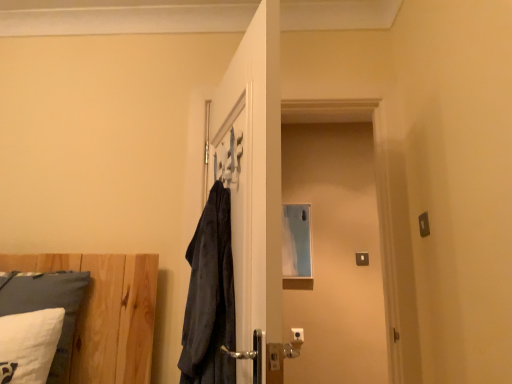
Question: Is transparent glass screen door at center taller or shorter than white soft pillow at lower left?

Choices:
 (A) short
 (B) tall

Answer: (B)

Question: Which is correct: transparent glass screen door at center is inside white soft pillow at lower left, or outside of it?

Choices:
 (A) inside
 (B) outside

Answer: (B)

Question: From the image's perspective, is transparent glass screen door at center above or below white soft pillow at lower left?

Choices:
 (A) above
 (B) below

Answer: (A)

Question: In terms of width, does white soft pillow at lower left look wider or thinner when compared to transparent glass screen door at center?

Choices:
 (A) thin
 (B) wide

Answer: (B)

Question: In the image, is white soft pillow at lower left positioned in front of or behind transparent glass screen door at center?

Choices:
 (A) front
 (B) behind

Answer: (A)

Question: Visually, is white soft pillow at lower left positioned to the left or to the right of transparent glass screen door at center?

Choices:
 (A) right
 (B) left

Answer: (B)

Question: From the image's perspective, is white soft pillow at lower left located above or below transparent glass screen door at center?

Choices:
 (A) above
 (B) below

Answer: (B)